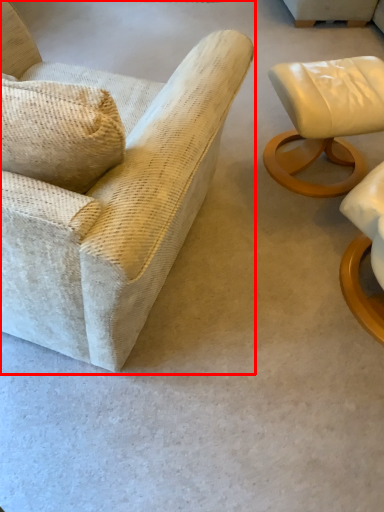
Question: Considering the relative positions of chair (annotated by the red box) and chair in the image provided, where is chair (annotated by the red box) located with respect to the staircase?

Choices:
 (A) left
 (B) right

Answer: (A)